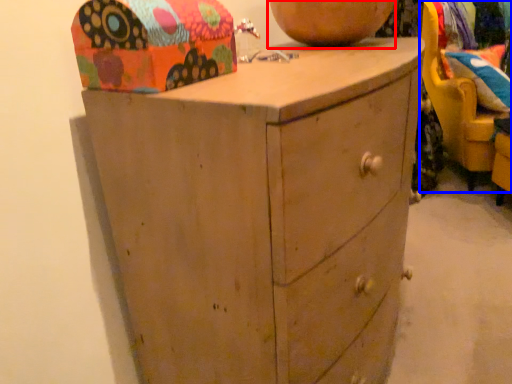
Question: Which object is closer to the camera taking this photo, vase (highlighted by a red box) or swivel chair (highlighted by a blue box)?

Choices:
 (A) vase
 (B) swivel chair

Answer: (A)